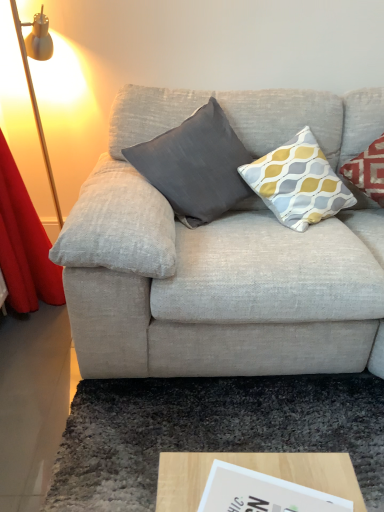
This screenshot has width=384, height=512. Identify the location of free location in front of gold metallic floor lamp at left. (30, 376).